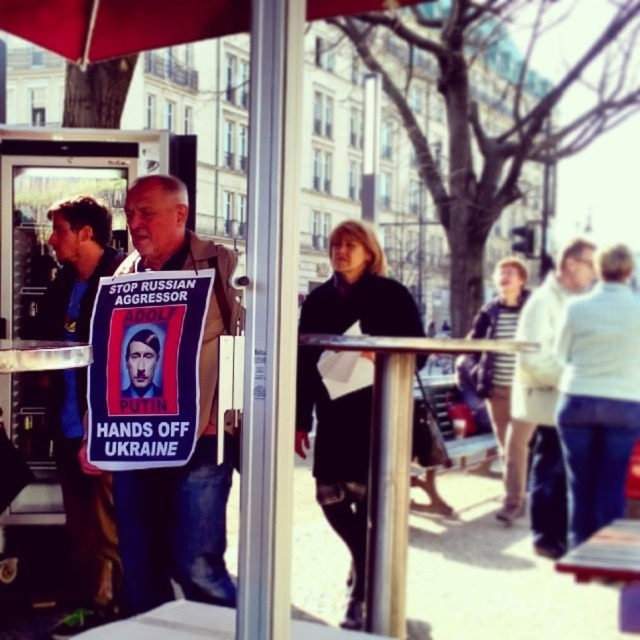
You are a photographer taking a picture of the protest scene. You notice the red fabric umbrella at upper left and the white cotton shirt at right. Which object should you focus on to capture more details in your photo?

The red fabric umbrella at upper left is smaller than the white cotton shirt at right, so focusing on the red fabric umbrella at upper left would allow you to capture more details since it is smaller and requires closer attention.